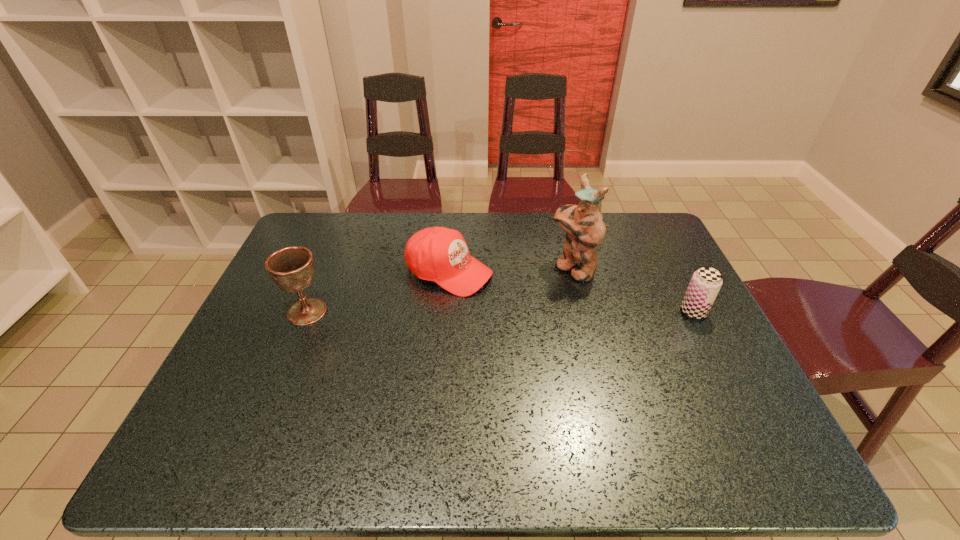
Image resolution: width=960 pixels, height=540 pixels. In order to click on vacant space that satisfies the following two spatial constraints: 1. on the front side of the tallest object; 2. on the left side of the rightmost object in this screenshot , I will do 584,312.